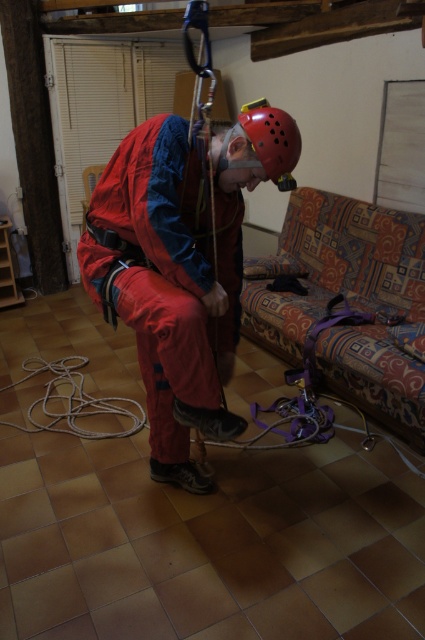
Question: Is patterned fabric couch at lower right to the right of red matte helmet at center from the viewer's perspective?

Choices:
 (A) yes
 (B) no

Answer: (A)

Question: Is patterned fabric couch at lower right positioned before red matte helmet at center?

Choices:
 (A) no
 (B) yes

Answer: (A)

Question: Which point appears farthest from the camera in this image?

Choices:
 (A) (176, 394)
 (B) (354, 289)

Answer: (B)

Question: Which object appears farthest from the camera in this image?

Choices:
 (A) matte red jumpsuit at center
 (B) red matte helmet at center

Answer: (B)

Question: Among these objects, which one is nearest to the camera?

Choices:
 (A) matte red jumpsuit at center
 (B) red matte helmet at center
 (C) patterned fabric couch at lower right

Answer: (A)

Question: Does patterned fabric couch at lower right have a smaller size compared to red matte helmet at center?

Choices:
 (A) yes
 (B) no

Answer: (B)